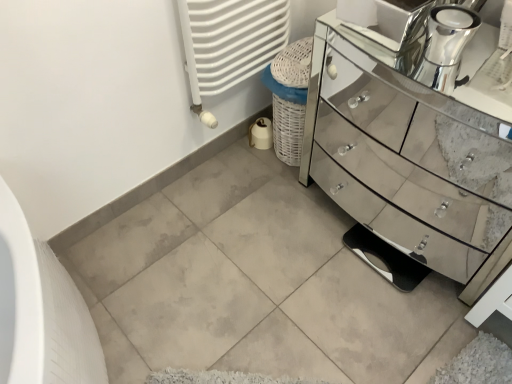
Question: Considering the positions of chrome metallic faucet at upper right and white textured radiator at upper center in the image, is chrome metallic faucet at upper right taller or shorter than white textured radiator at upper center?

Choices:
 (A) tall
 (B) short

Answer: (B)

Question: From the image's perspective, is chrome metallic faucet at upper right positioned above or below white textured radiator at upper center?

Choices:
 (A) below
 (B) above

Answer: (A)

Question: Which object is positioned closest to the chrome metallic faucet at upper right?

Choices:
 (A) white textured radiator at upper center
 (B) mirror-finished glass chest of drawers at right

Answer: (B)

Question: Which object is positioned closest to the white textured radiator at upper center?

Choices:
 (A) mirror-finished glass chest of drawers at right
 (B) chrome metallic faucet at upper right

Answer: (A)